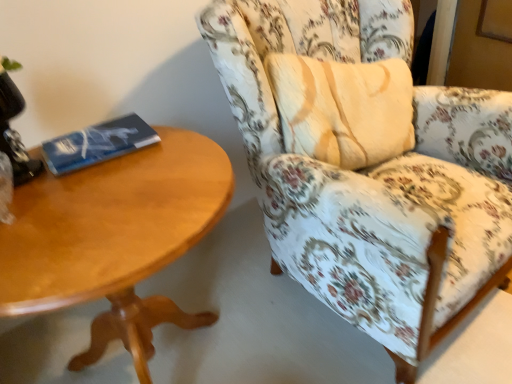
Identify the location of vacant area located to the right-hand side of blue matte paperback book at left. (168, 153).